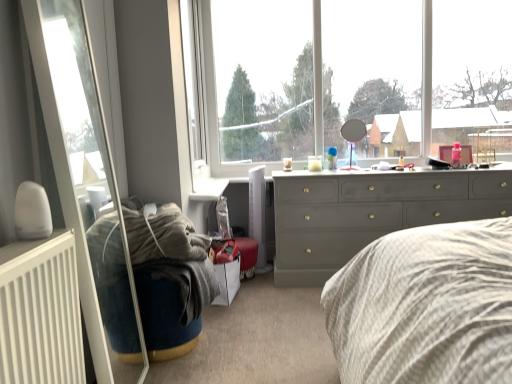
Question: Is the depth of white matte radiator at lower left less than that of matte gray dresser at center?

Choices:
 (A) yes
 (B) no

Answer: (A)

Question: From a real-world perspective, is white matte radiator at lower left positioned over matte gray dresser at center based on gravity?

Choices:
 (A) yes
 (B) no

Answer: (A)

Question: Is white matte radiator at lower left touching matte gray dresser at center?

Choices:
 (A) no
 (B) yes

Answer: (A)

Question: Is white matte radiator at lower left shorter than matte gray dresser at center?

Choices:
 (A) yes
 (B) no

Answer: (A)

Question: Considering the relative sizes of white matte radiator at lower left and matte gray dresser at center in the image provided, is white matte radiator at lower left bigger than matte gray dresser at center?

Choices:
 (A) no
 (B) yes

Answer: (A)

Question: In terms of height, does transparent glass mirror at upper center look taller or shorter compared to velvet blue bean bag at lower left?

Choices:
 (A) short
 (B) tall

Answer: (B)

Question: Is point (354, 61) positioned closer to the camera than point (199, 269)?

Choices:
 (A) closer
 (B) farther

Answer: (B)

Question: Is transparent glass mirror at upper center in front of or behind velvet blue bean bag at lower left in the image?

Choices:
 (A) behind
 (B) front

Answer: (A)

Question: From the image's perspective, is transparent glass mirror at upper center located above or below velvet blue bean bag at lower left?

Choices:
 (A) below
 (B) above

Answer: (B)

Question: In terms of width, does transparent glass door at left look wider or thinner when compared to matte gray dresser at center?

Choices:
 (A) thin
 (B) wide

Answer: (A)

Question: Choose the correct answer: Is transparent glass door at left inside matte gray dresser at center or outside it?

Choices:
 (A) outside
 (B) inside

Answer: (A)

Question: From a real-world perspective, is transparent glass door at left physically located above or below matte gray dresser at center?

Choices:
 (A) above
 (B) below

Answer: (A)

Question: From the image's perspective, is transparent glass door at left above or below matte gray dresser at center?

Choices:
 (A) below
 (B) above

Answer: (B)

Question: Does point (10, 342) appear closer or farther from the camera than point (494, 170)?

Choices:
 (A) farther
 (B) closer

Answer: (B)

Question: In terms of height, does white matte radiator at lower left look taller or shorter compared to matte gray dresser at center?

Choices:
 (A) tall
 (B) short

Answer: (B)